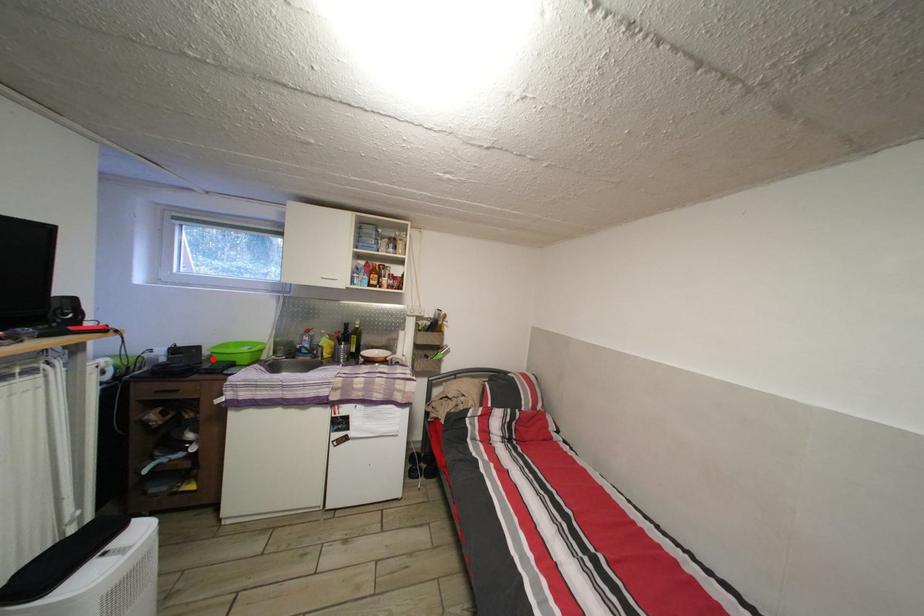
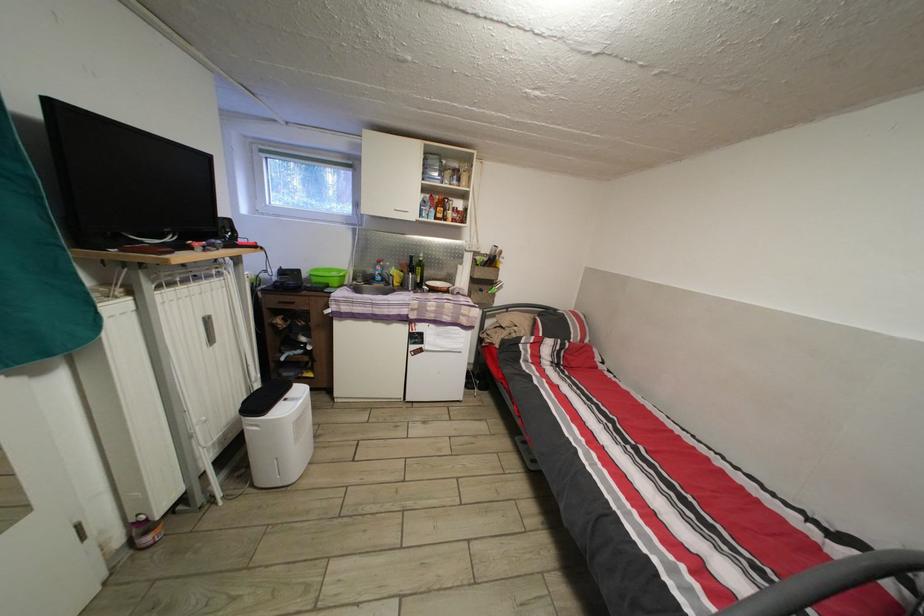
The point at the highlighted location is marked in the first image. Where is the corresponding point in the second image?

(311, 282)